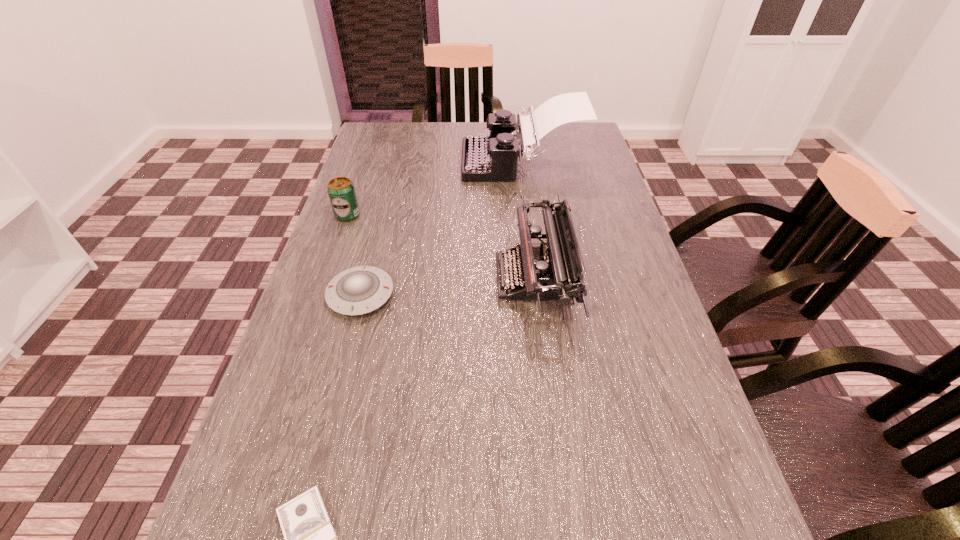
Locate an element on the screen. The image size is (960, 540). free space at the left edge is located at coordinates (324, 399).

At what (x,y) coordinates should I click in order to perform the action: click on vacant region at the right edge of the desktop. Please return your answer as a coordinate pair (x, y). Looking at the image, I should click on (563, 170).

You are a GUI agent. You are given a task and a screenshot of the screen. Output one action in this format:
    pyautogui.click(x=<x>, y=<y>)
    Task: Click on the vacant space at the far right corner of the desktop
    This screenshot has height=540, width=960.
    Given the screenshot: What is the action you would take?
    pyautogui.click(x=589, y=141)

At what (x,y) coordinates should I click in order to perform the action: click on free space between the farther typewriter and the saucer. Please return your answer as a coordinate pair (x, y). This screenshot has width=960, height=540. Looking at the image, I should click on (441, 228).

Identify the location of empty location between the fourth tallest object and the tallest object. The height and width of the screenshot is (540, 960). (441, 228).

The height and width of the screenshot is (540, 960). Find the location of `free area in between the third tallest object and the shorter typewriter`. free area in between the third tallest object and the shorter typewriter is located at coordinates (441, 247).

The width and height of the screenshot is (960, 540). I want to click on empty location between the beer can and the second tallest object, so click(441, 247).

This screenshot has height=540, width=960. Find the location of `unoccupied position between the nearer typewriter and the second shortest object`. unoccupied position between the nearer typewriter and the second shortest object is located at coordinates (447, 287).

What are the coordinates of `unoccupied area between the third shortest object and the fourth shortest object` in the screenshot? It's located at (441, 247).

You are a GUI agent. You are given a task and a screenshot of the screen. Output one action in this format:
    pyautogui.click(x=<x>, y=<y>)
    Task: Click on the object that stands as the second closest to the saucer
    
    Given the screenshot: What is the action you would take?
    pyautogui.click(x=552, y=271)